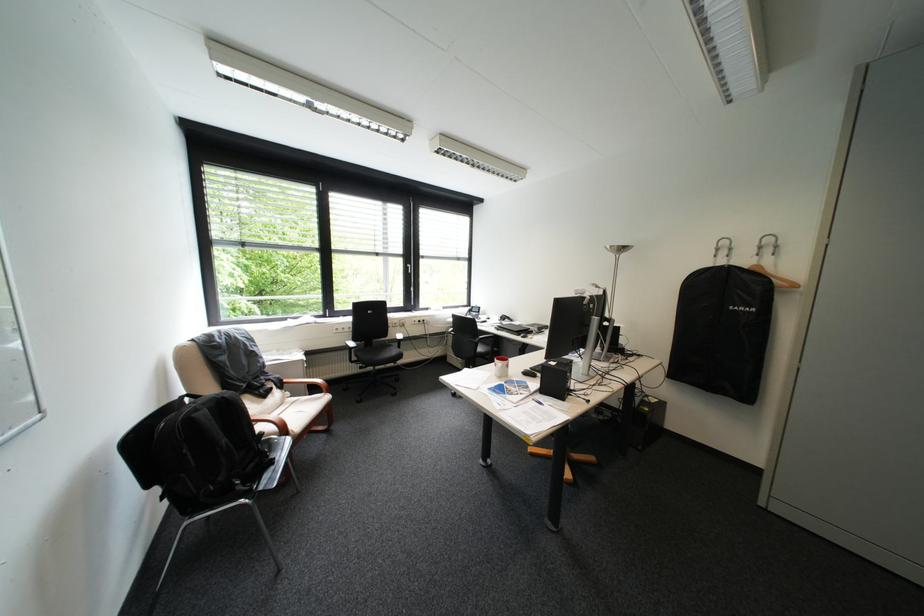
Image resolution: width=924 pixels, height=616 pixels. What are the coordinates of `beige chair sitting surface` in the screenshot? It's located at (288, 411).